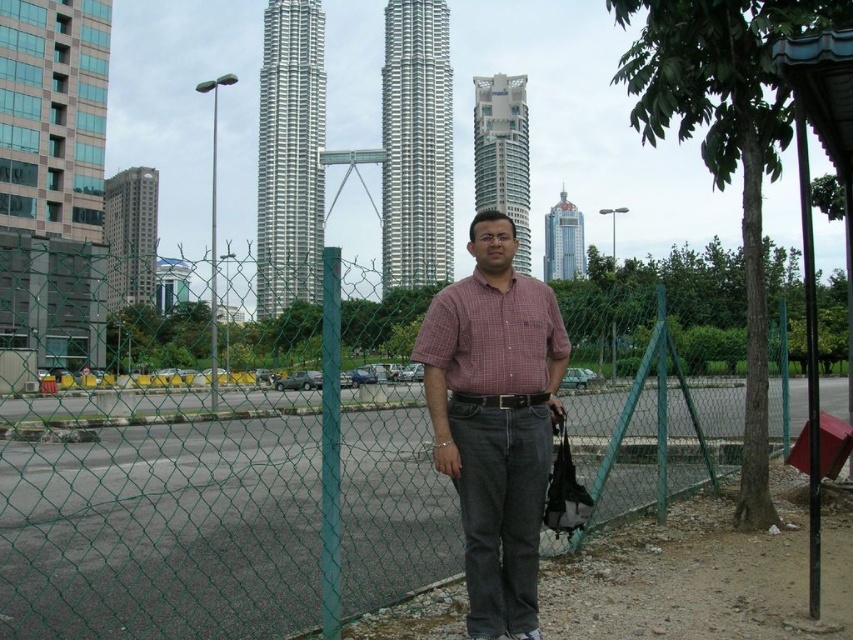
Question: Is plaid cotton shirt at center positioned behind checkered fabric shirt at center?

Choices:
 (A) yes
 (B) no

Answer: (B)

Question: Is plaid cotton shirt at center above checkered fabric shirt at center?

Choices:
 (A) no
 (B) yes

Answer: (A)

Question: Which point appears farthest from the camera in this image?

Choices:
 (A) (486, 349)
 (B) (677, 456)
 (C) (488, 426)

Answer: (B)

Question: Does green chain-link fence at center have a smaller size compared to plaid cotton shirt at center?

Choices:
 (A) no
 (B) yes

Answer: (A)

Question: Estimate the real-world distances between objects in this image. Which object is farther from the checkered fabric shirt at center?

Choices:
 (A) plaid cotton shirt at center
 (B) green chain-link fence at center

Answer: (B)

Question: Estimate the real-world distances between objects in this image. Which object is closer to the checkered fabric shirt at center?

Choices:
 (A) green chain-link fence at center
 (B) plaid cotton shirt at center

Answer: (B)